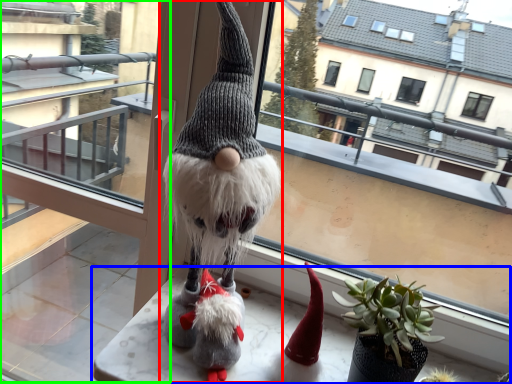
Question: Estimate the real-world distances between objects in this image. Which object is closer to figurine (highlighted by a red box), table (highlighted by a blue box) or glass door (highlighted by a green box)?

Choices:
 (A) table
 (B) glass door

Answer: (A)